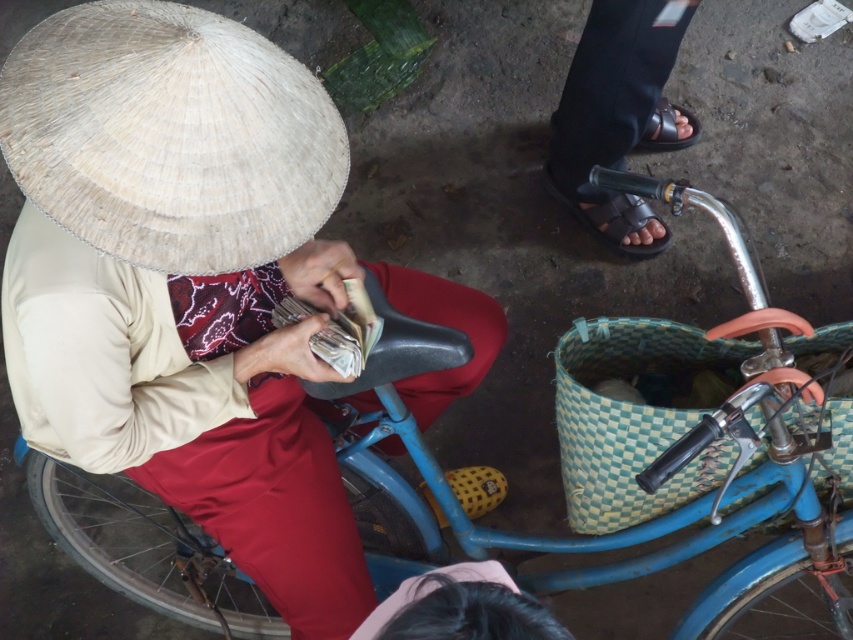
Question: Among these points, which one is farthest from the camera?

Choices:
 (A) (247, 193)
 (B) (241, 572)
 (C) (659, 124)

Answer: (C)

Question: Is matte straw hat at upper left further to the viewer compared to green woven basket at lower right?

Choices:
 (A) no
 (B) yes

Answer: (A)

Question: Is green woven basket at lower right to the right of black rubber sandal at lower right from the viewer's perspective?

Choices:
 (A) yes
 (B) no

Answer: (B)

Question: Estimate the real-world distances between objects in this image. Which object is farther from the green woven basket at lower right?

Choices:
 (A) blue matte bicycle at center
 (B) black rubber sandal at upper right

Answer: (B)

Question: Considering the real-world distances, which object is farthest from the natural straw hat at upper left?

Choices:
 (A) black leather sandals at upper right
 (B) blue matte bicycle at center

Answer: (A)

Question: Does natural straw hat at upper left have a larger size compared to black rubber sandal at lower right?

Choices:
 (A) no
 (B) yes

Answer: (B)